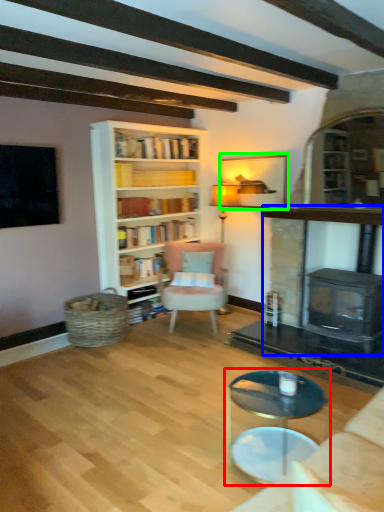
Question: Considering the real-world distances, which object is closest to coffee table (highlighted by a red box)? fireplace (highlighted by a blue box) or picture frame (highlighted by a green box).

Choices:
 (A) fireplace
 (B) picture frame

Answer: (A)